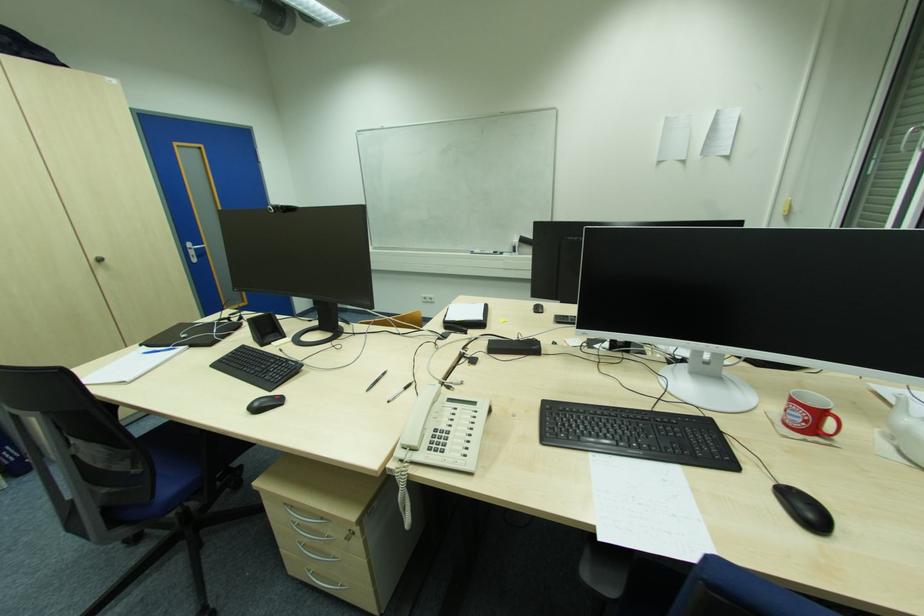
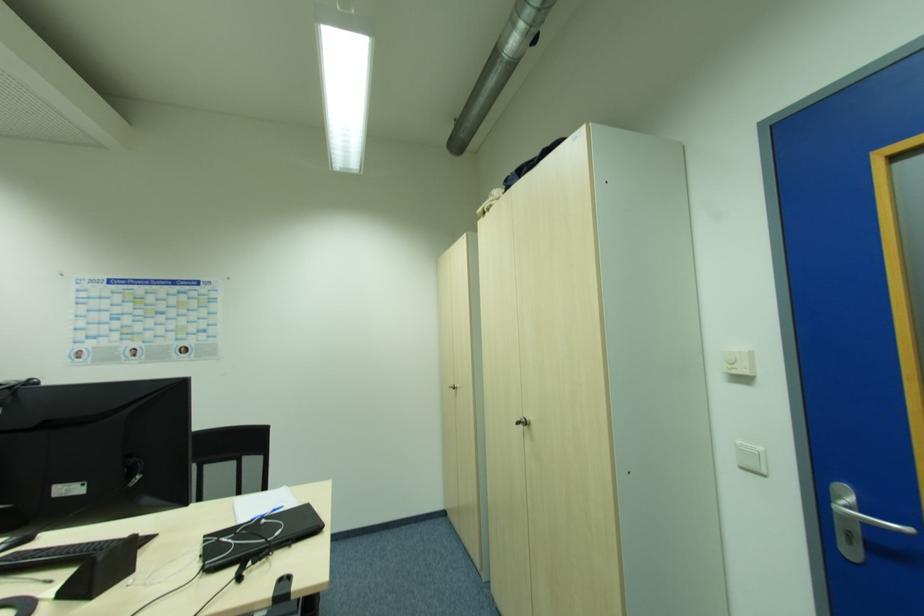
Locate, in the second image, the point that corresponds to (x=103, y=261) in the first image.

(526, 424)